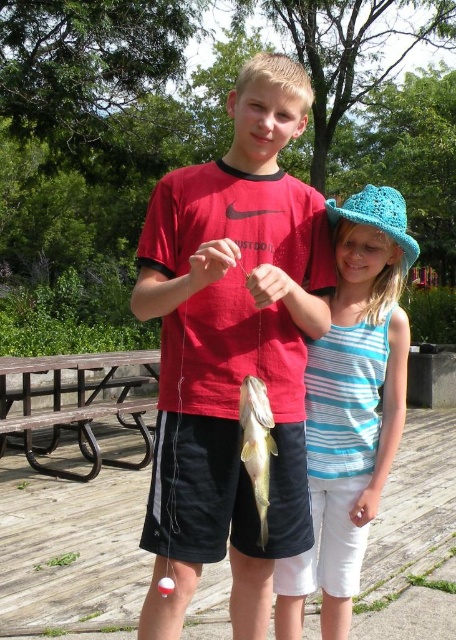
Question: In this image, where is blue striped tank top at center located relative to brown wooden picnic table at lower left?

Choices:
 (A) below
 (B) above

Answer: (B)

Question: Observing the image, what is the correct spatial positioning of matte red shirt at center in reference to brown wooden picnic table at lower left?

Choices:
 (A) above
 (B) below

Answer: (A)

Question: Which of the following is the farthest from the observer?

Choices:
 (A) brown wooden picnic table at lower left
 (B) blue striped tank top at center

Answer: (A)

Question: Among these objects, which one is nearest to the camera?

Choices:
 (A) matte red shirt at center
 (B) blue striped tank top at center

Answer: (A)

Question: Does matte red shirt at center appear under blue striped tank top at center?

Choices:
 (A) no
 (B) yes

Answer: (A)

Question: Considering the real-world distances, which object is closest to the matte red shirt at center?

Choices:
 (A) yellowish-green shiny fish at center
 (B) brown wooden picnic table at lower left
 (C) blue striped tank top at center

Answer: (A)